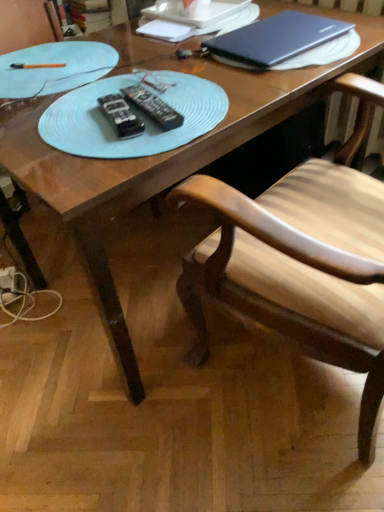
Locate an element on the screen. The image size is (384, 512). vacant space in front of light blue plastic plate at upper left is located at coordinates (72, 126).